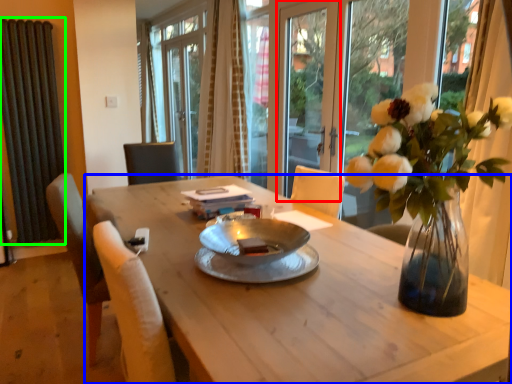
Question: Based on their relative distances, which object is farther from screen door (highlighted by a red box)? Choose from desk (highlighted by a blue box) and radiator (highlighted by a green box).

Choices:
 (A) desk
 (B) radiator

Answer: (B)